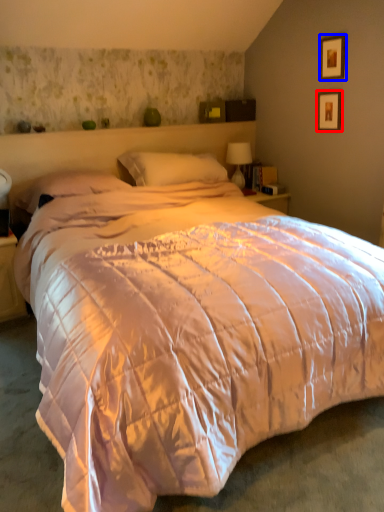
Question: Which of the following is the farthest to the observer, picture frame (highlighted by a red box) or picture frame (highlighted by a blue box)?

Choices:
 (A) picture frame
 (B) picture frame

Answer: (A)